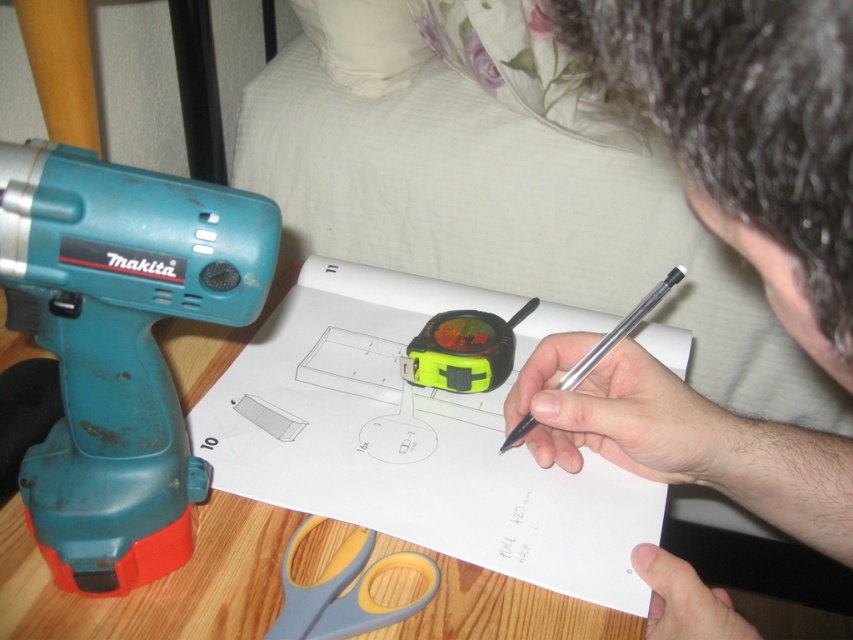
You are a carpenter who needs to measure the distance between the teal plastic drill at left and the camera. Can you confirm if the distance is more than a foot?

The teal plastic drill at left and the camera are 11.95 inches apart. Since 11.95 inches is less than 12 inches, the distance is not more than a foot.

You are taking a photo of the scene described. The point at coordinates (485, 324) is part of the image you want to capture. If your camera is positioned 22.61 inches away from this point, will the point be in focus if your camera has a minimum focus distance of 24 inches?

The point at coordinates (485, 324) is 22.61 inches away from the camera, which is closer than the camera minimum focus distance of 24 inches. Therefore, the point will not be in focus.